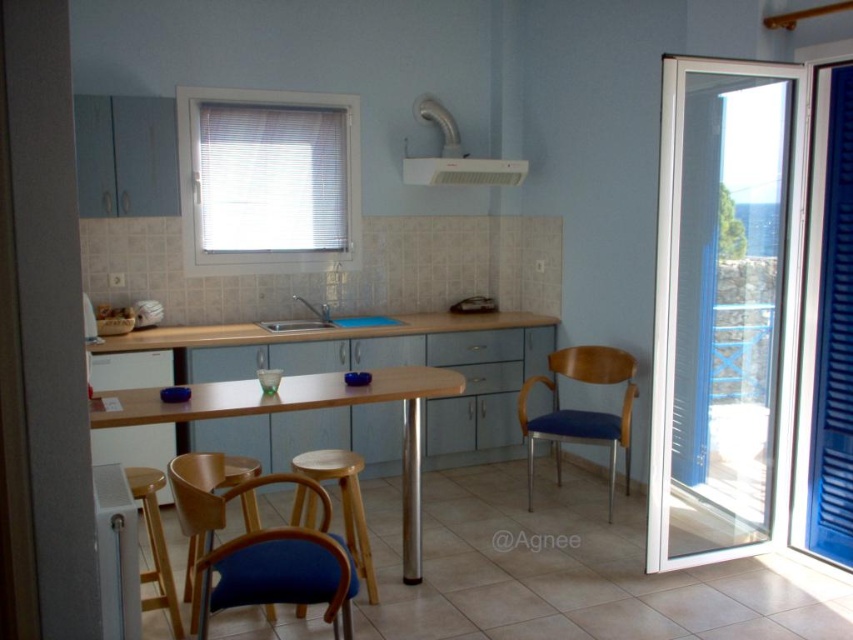
You are sitting in the blue fabric chair at center and want to place a plate on the wooden table at center. Can you reach the table from your current position without moving your chair?

The wooden table at center is in front of the blue fabric chair at center, so yes, you can reach the table from your current position without moving your chair.

In the scene shown: You are a person sitting in the blue fabric chair at lower center. You want to wash your hands in the matte stainless steel sink at center. Can you reach the sink without moving from your current position?

The blue fabric chair at lower center is in front of the matte stainless steel sink at center, so you can reach the sink without needing to move from your current position.